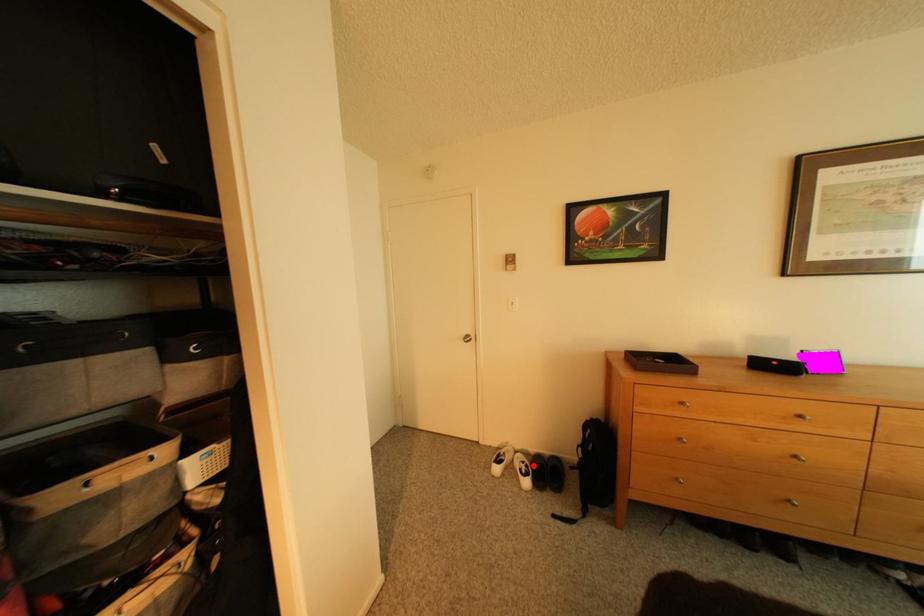
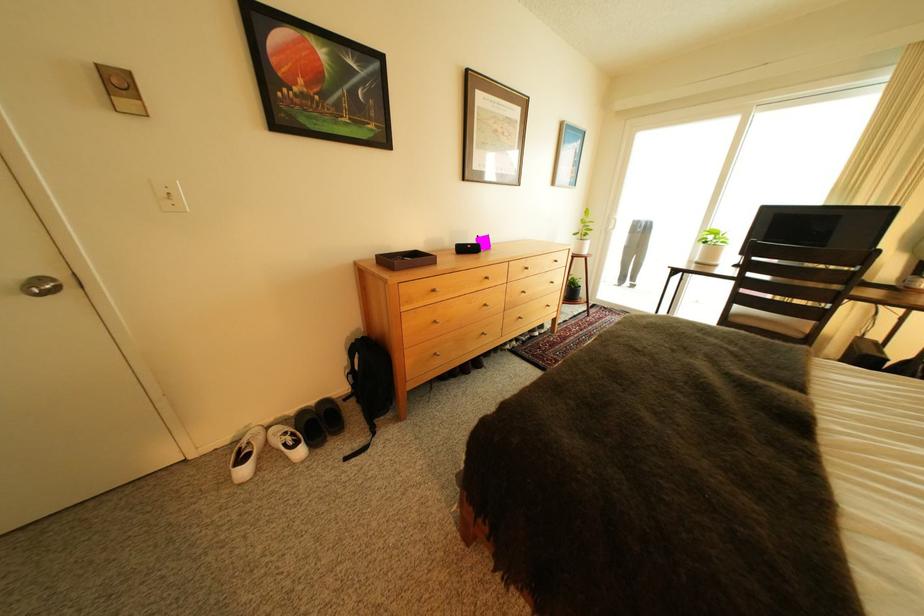
Question: I am providing you with two images of the same scene from different viewpoints. Image1 has a red point marked. In image2, the corresponding 3D location appears at what relative position? Reply with the corresponding letter.

Choices:
 (A) Closer
 (B) Farther

Answer: (A)